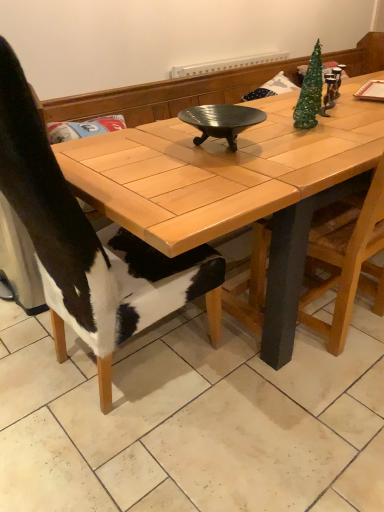
Identify the location of free region on the left part of black ribbed metal wok at center. The image size is (384, 512). (140, 152).